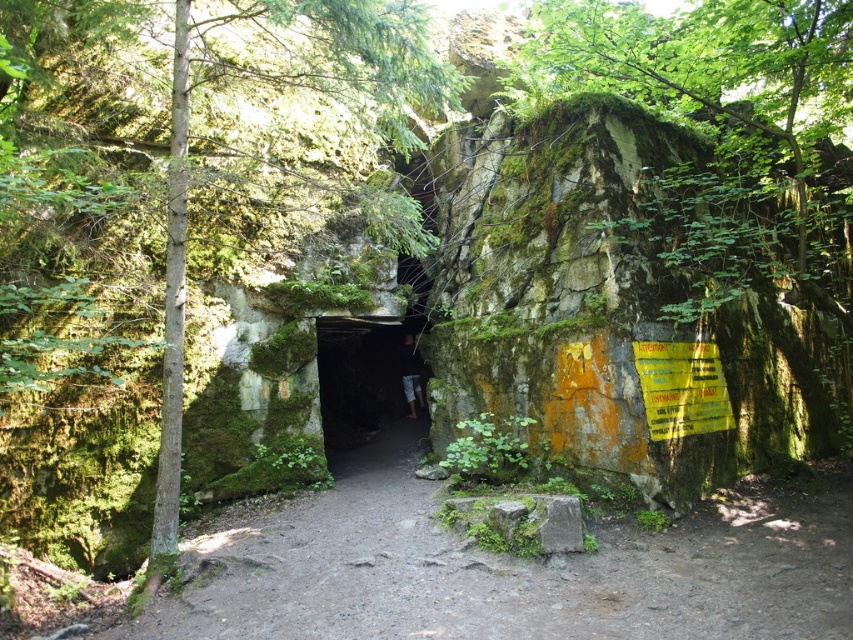
Question: Among these points, which one is farthest from the camera?

Choices:
 (A) (332, 396)
 (B) (363, 588)
 (C) (419, 401)

Answer: (A)

Question: Can you confirm if dirt path at center is positioned to the left of dark fabric pants at center?

Choices:
 (A) yes
 (B) no

Answer: (B)

Question: Is dirt path at center thinner than dark fabric pants at center?

Choices:
 (A) no
 (B) yes

Answer: (A)

Question: Among these objects, which one is nearest to the camera?

Choices:
 (A) dark fabric pants at center
 (B) green mossy cave at center
 (C) dirt path at center

Answer: (C)

Question: Which of these objects is positioned farthest from the dirt path at center?

Choices:
 (A) green mossy tree at center
 (B) green mossy cave at center
 (C) dark fabric pants at center

Answer: (C)

Question: Can you confirm if dirt path at center is positioned to the right of dark fabric pants at center?

Choices:
 (A) no
 (B) yes

Answer: (B)